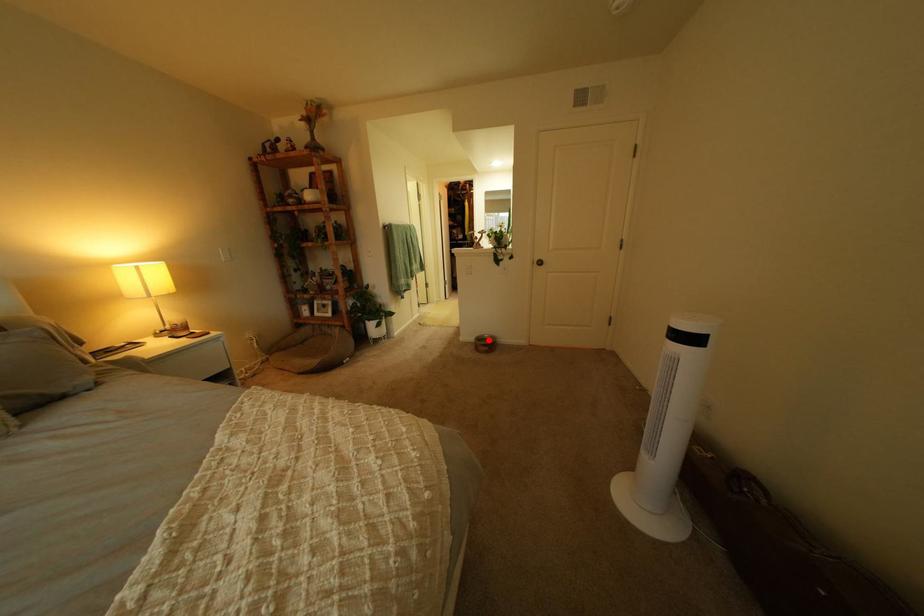
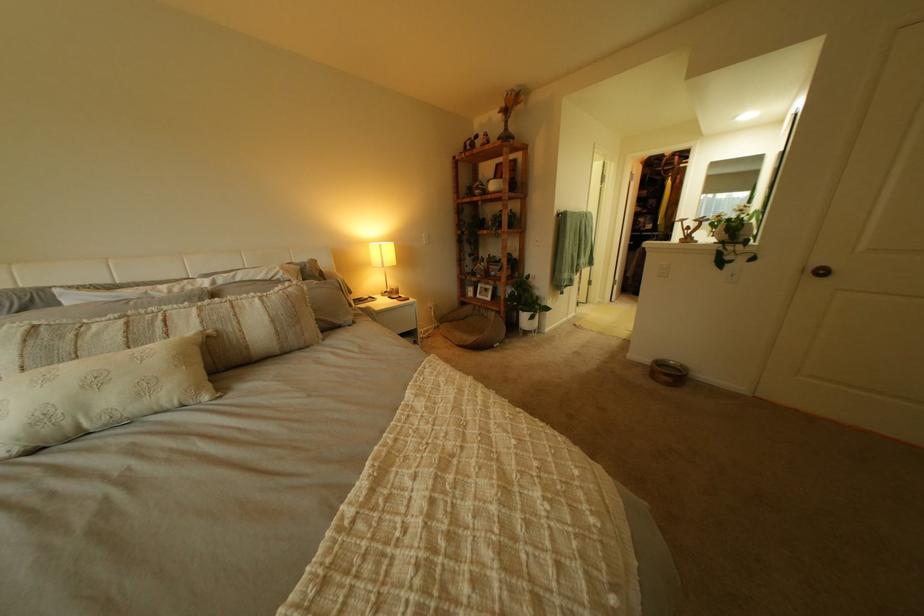
Question: I am providing you with two images of the same scene from different viewpoints. In image1, a red point is highlighted. Considering the same 3D point in image2, which of the following is correct?

Choices:
 (A) It is closer
 (B) It is farther

Answer: (A)